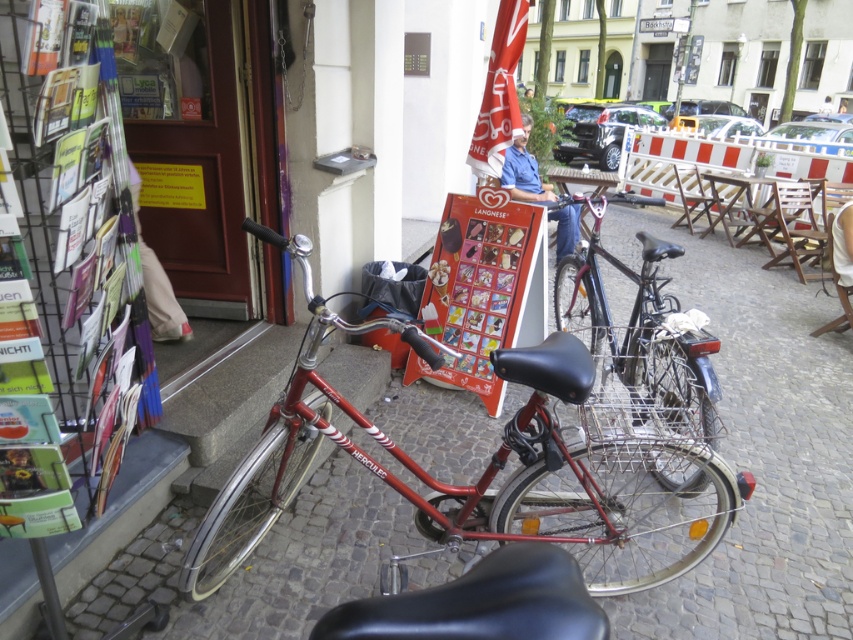
Based on the photo, which is more to the right, shiny red bicycle at center or shiny metallic bicycle at center?

Positioned to the right is shiny metallic bicycle at center.

Does shiny red bicycle at center appear under shiny metallic bicycle at center?

Correct, shiny red bicycle at center is located below shiny metallic bicycle at center.

Where is `shiny red bicycle at center`? The height and width of the screenshot is (640, 853). shiny red bicycle at center is located at coordinates (491, 481).